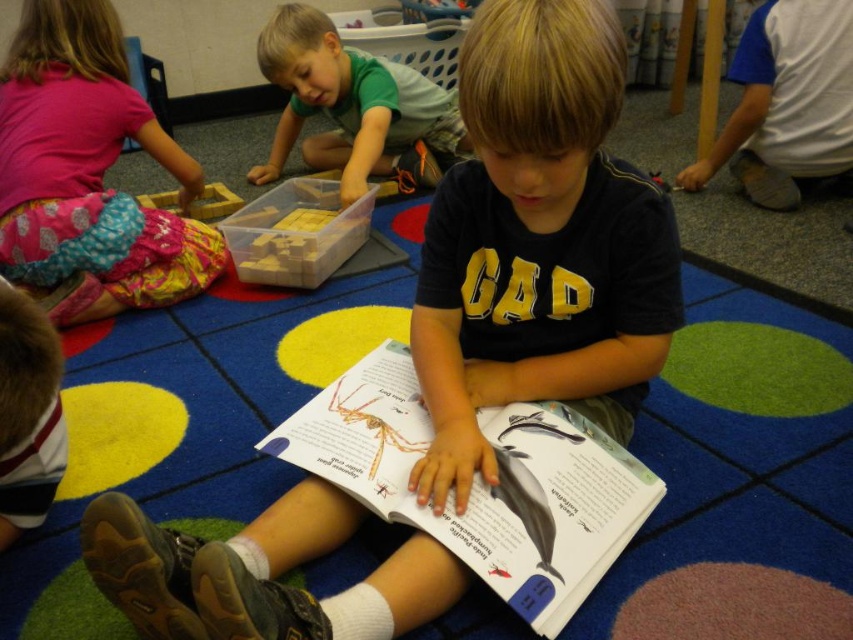
You are a teacher in the classroom and want to hand out a new worksheet to both the white paper book at center and the green matte shirt at upper center. The worksheets are placed on a desk 3 feet away from you. Can you reach both objects without moving from your current position?

The white paper book at center is 4.20 feet away from the green matte shirt at upper center. Since the worksheets are on a desk 3 feet away from you, you can reach both objects as they are within your 3 feet reach.

In the classroom scene, there are two shirts visible on the carpeted floor. The matte pink shirt at upper left and the white cotton shirt at lower right. Which shirt is positioned to the left of the other?

The matte pink shirt at upper left is positioned to the left of the white cotton shirt at lower right.

You are standing at the point marked as point (518, 528) in the image. A teacher wants you to move 40 inches forward. Will you be able to reach the front of the classroom without hitting any obstacles?

The distance between you and the front of the classroom is 38.37 inches. Since you need to move 40 inches forward, you will go 1.63 inches beyond the front of the classroom, so you might hit an obstacle or go too far.